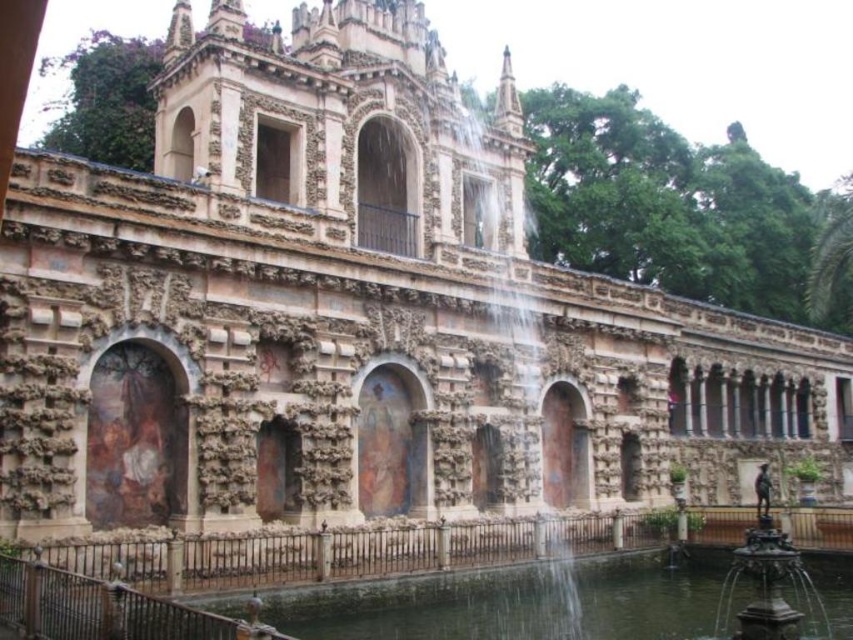
Question: Can you confirm if clear water at fountain center is positioned to the left of bronze/ornate fountain at lower right?

Choices:
 (A) yes
 (B) no

Answer: (A)

Question: Does clear water at fountain center appear on the right side of bronze/ornate fountain at lower right?

Choices:
 (A) no
 (B) yes

Answer: (A)

Question: Among these points, which one is farthest from the camera?

Choices:
 (A) (799, 620)
 (B) (564, 595)

Answer: (B)

Question: Observing the image, what is the correct spatial positioning of clear water at fountain center in reference to bronze/ornate fountain at lower right?

Choices:
 (A) below
 (B) above

Answer: (A)